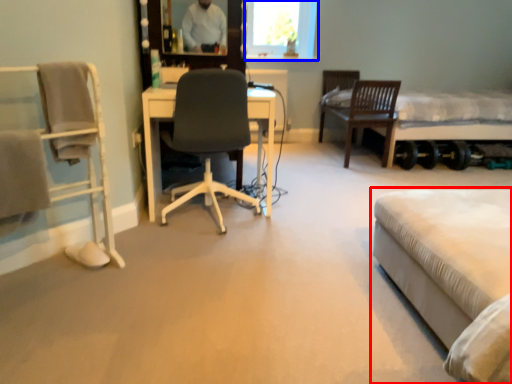
Question: Among these objects, which one is farthest to the camera, bed (highlighted by a red box) or window screen (highlighted by a blue box)?

Choices:
 (A) bed
 (B) window screen

Answer: (B)